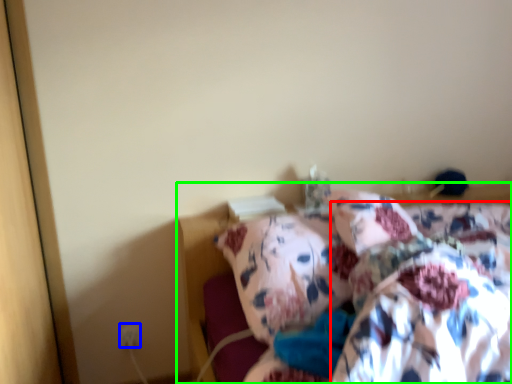
Question: Based on their relative distances, which object is nearer to blanket (highlighted by a red box)? Choose from electric outlet (highlighted by a blue box) and bed (highlighted by a green box).

Choices:
 (A) electric outlet
 (B) bed

Answer: (B)